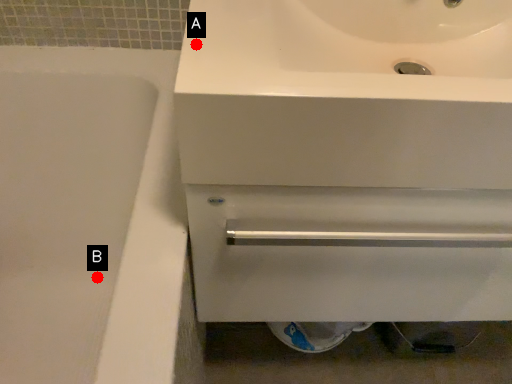
Question: Two points are circled on the image, labeled by A and B beside each circle. Which point is farther to the camera?

Choices:
 (A) A is further
 (B) B is further

Answer: (B)